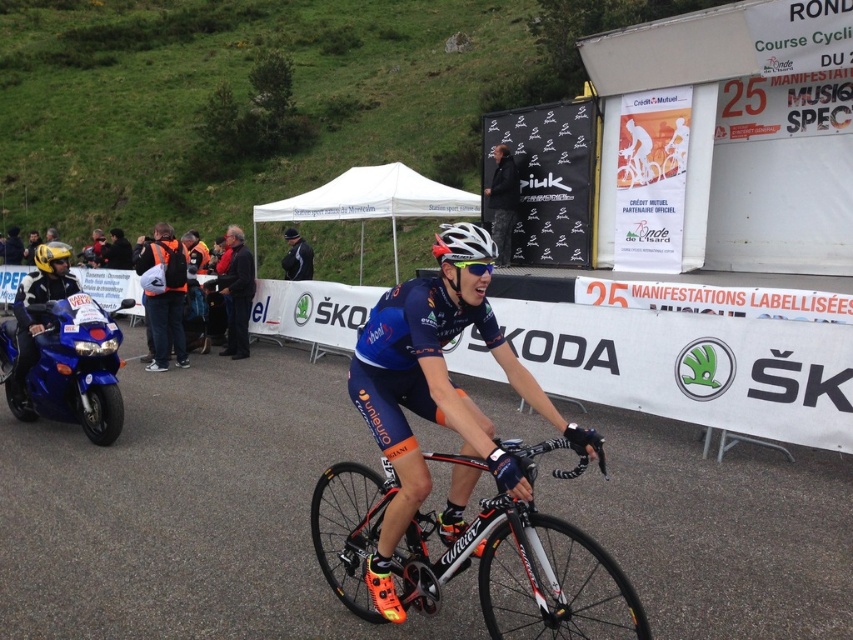
Question: Which point appears farthest from the camera in this image?

Choices:
 (A) (120, 416)
 (B) (39, 445)
 (C) (508, 164)

Answer: (C)

Question: Does white matte helmet at center appear under white matte bicycle helmet at center?

Choices:
 (A) yes
 (B) no

Answer: (B)

Question: Which of the following is the farthest from the observer?

Choices:
 (A) (229, 332)
 (B) (454, 248)

Answer: (A)

Question: Among these points, which one is farthest from the camera?

Choices:
 (A) (297, 234)
 (B) (383, 429)
 (C) (13, 438)

Answer: (A)

Question: Can you confirm if shiny metallic bicycle at center is positioned below white matte helmet at center?

Choices:
 (A) no
 (B) yes

Answer: (B)

Question: Can you confirm if shiny metallic bicycle at center is positioned below shiny blue motorcycle at left?

Choices:
 (A) yes
 (B) no

Answer: (A)